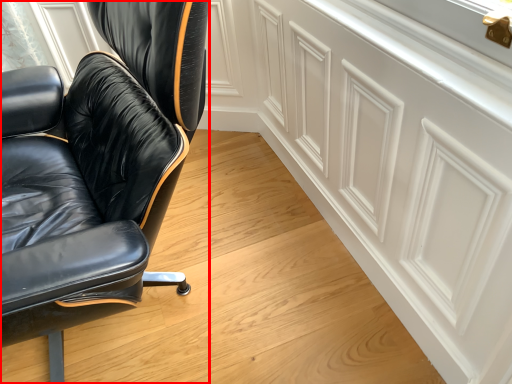
Question: From the image's perspective, considering the relative positions of chair (annotated by the red box) and cabinetry in the image provided, where is chair (annotated by the red box) located with respect to the staircase?

Choices:
 (A) below
 (B) above

Answer: (B)